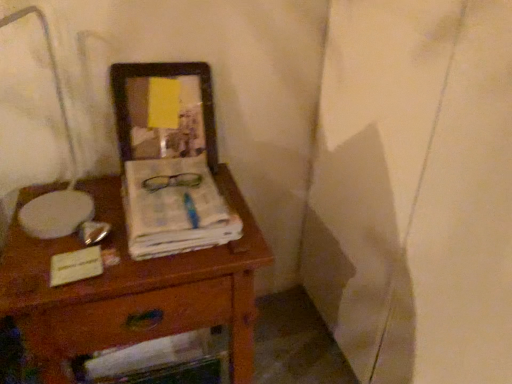
Identify the location of vacant region above white paper at center (from a real-world perspective). (176, 196).